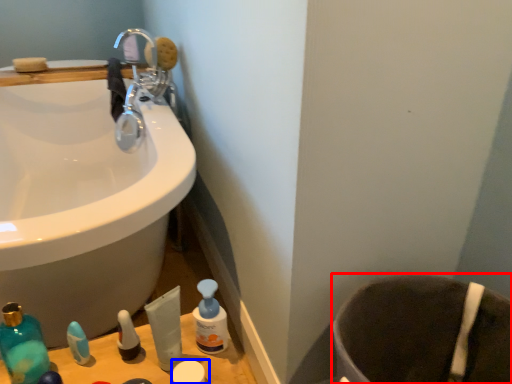
Question: Which object appears closest to the camera in this image, toilet bowl (highlighted by a red box) or toiletry (highlighted by a blue box)?

Choices:
 (A) toilet bowl
 (B) toiletry

Answer: (A)